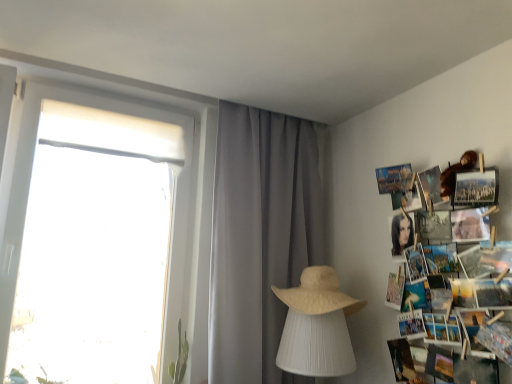
Question: Is point (472, 299) positioned closer to the camera than point (317, 273)?

Choices:
 (A) closer
 (B) farther

Answer: (A)

Question: From the image's perspective, is printed paper collage at right above or below beige straw hat at center?

Choices:
 (A) above
 (B) below

Answer: (A)

Question: Estimate the real-world distances between objects in this image. Which object is closer to the printed paper collage at right?

Choices:
 (A) beige straw hat at center
 (B) gray sheer curtain at center

Answer: (A)

Question: Which of these objects is positioned closest to the printed paper collage at right?

Choices:
 (A) beige straw hat at center
 (B) gray sheer curtain at center

Answer: (A)